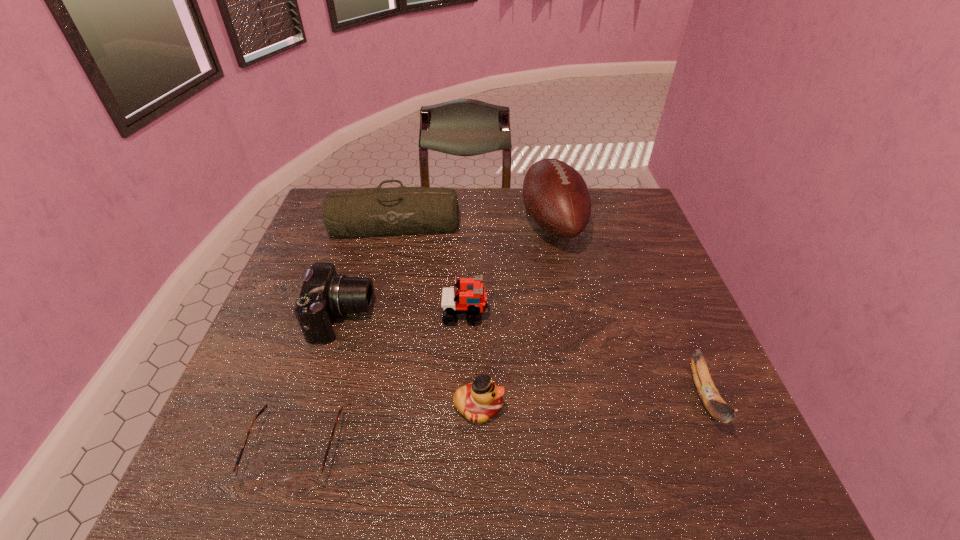
Locate an element on the screen. The height and width of the screenshot is (540, 960). object that is at the right edge is located at coordinates (717, 407).

Where is `object positioned at the far left corner`? The image size is (960, 540). object positioned at the far left corner is located at coordinates (364, 212).

In order to click on object located in the near left corner section of the desktop in this screenshot , I will do `click(303, 483)`.

In the image, there is a desktop. What are the coordinates of `blank space at the far edge` in the screenshot? It's located at (510, 197).

Find the location of a particular element. This screenshot has width=960, height=540. vacant space at the near edge is located at coordinates [502, 492].

Where is `vacant region at the left edge`? vacant region at the left edge is located at coordinates (243, 389).

The height and width of the screenshot is (540, 960). I want to click on vacant position at the right edge of the desktop, so click(x=660, y=315).

In the image, there is a desktop. Identify the location of vacant space at the near left corner. (249, 454).

Locate an element on the screen. free region at the near right corner of the desktop is located at coordinates (763, 488).

You are a GUI agent. You are given a task and a screenshot of the screen. Output one action in this format:
    pyautogui.click(x=<x>, y=<y>)
    Task: Click on the vacant area that lies between the Lego and the duck
    The height and width of the screenshot is (540, 960).
    Given the screenshot: What is the action you would take?
    pyautogui.click(x=472, y=360)